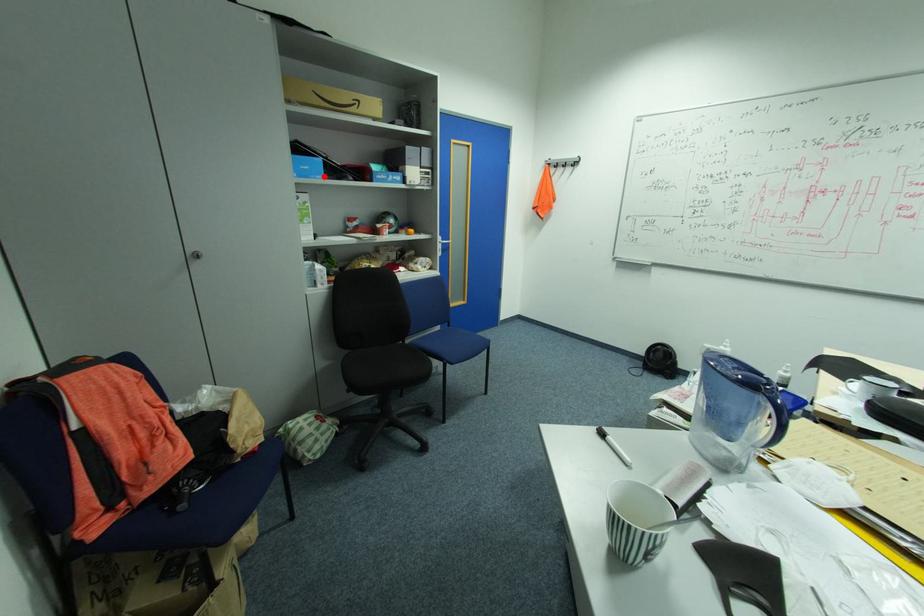
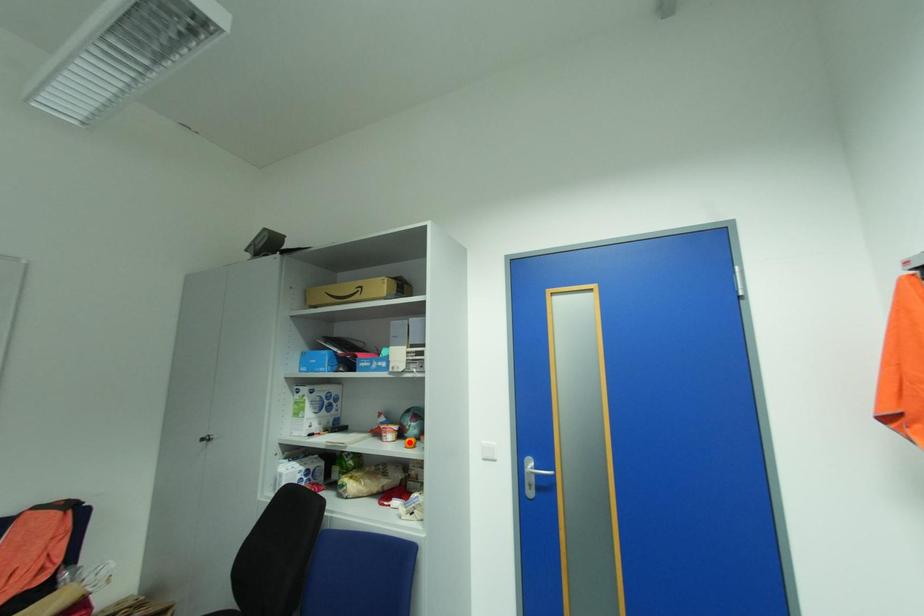
I am providing you with two images of the same scene from different viewpoints. A red point is marked on the first image and another point is marked on the second image. Is the marked point in image1 the same physical position as the marked point in image2?

No